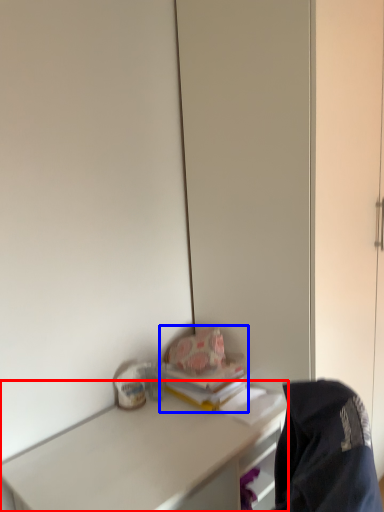
Question: Which point is closer to the camera, desk (highlighted by a red box) or book (highlighted by a blue box)?

Choices:
 (A) desk
 (B) book

Answer: (A)